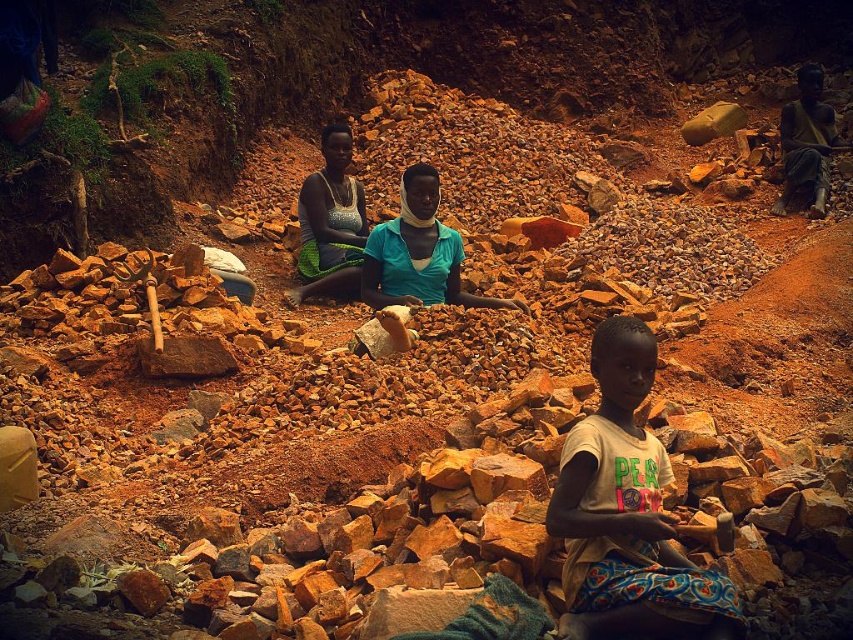
You are a photographer trying to capture the child in the mining scene. You notice the light brown cotton shirt at center and the shiny metallic necklace at center. Which item is closer to the camera lens?

The light brown cotton shirt at center is positioned under the shiny metallic necklace at center, so the necklace is closer to the camera lens.